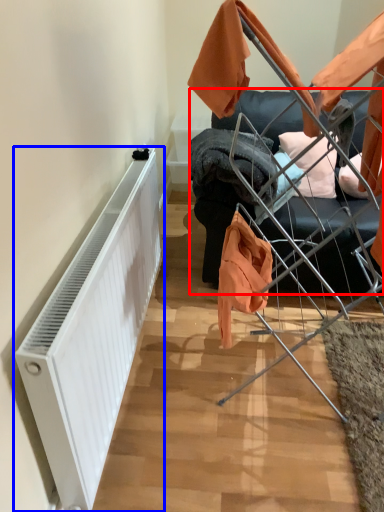
Question: Which of the following is the farthest to the observer, furniture (highlighted by a red box) or radiator (highlighted by a blue box)?

Choices:
 (A) furniture
 (B) radiator

Answer: (A)